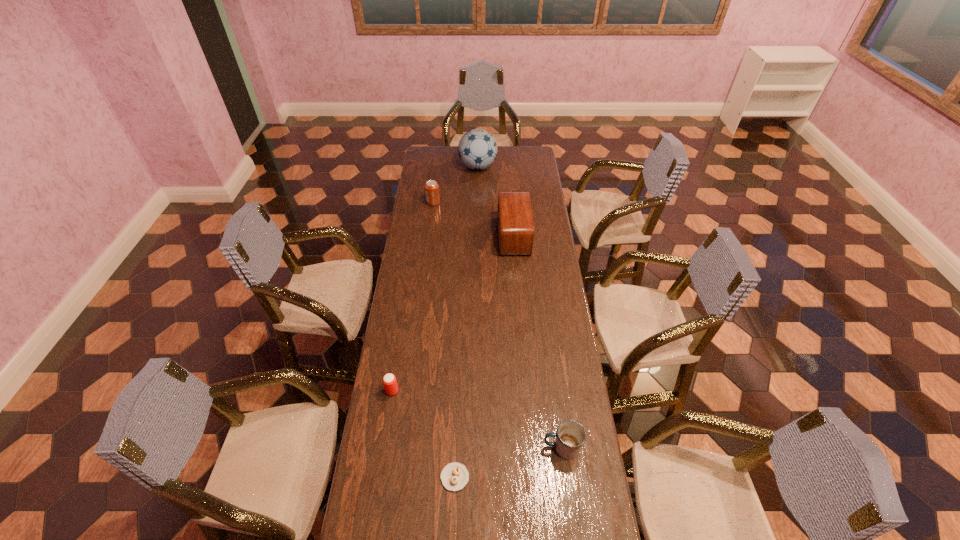
What are the coordinates of `free space located on the front of the beer can` in the screenshot? It's located at (376, 492).

This screenshot has width=960, height=540. I want to click on blank space located on the left of the cupcake, so click(403, 477).

What are the coordinates of `object that is at the far edge` in the screenshot? It's located at (477, 149).

The image size is (960, 540). I want to click on can at the left edge, so click(432, 193).

Find the location of a particular element. This screenshot has height=540, width=960. beer can that is at the left edge is located at coordinates (389, 380).

The width and height of the screenshot is (960, 540). Identify the location of radio receiver that is positioned at the right edge. (515, 220).

The width and height of the screenshot is (960, 540). Identify the location of mug present at the right edge. (571, 435).

At what (x,y) coordinates should I click in order to perform the action: click on free location at the far edge of the desktop. Please return your answer as a coordinate pair (x, y). Image resolution: width=960 pixels, height=540 pixels. Looking at the image, I should click on (500, 152).

Where is `free region at the left edge`? The height and width of the screenshot is (540, 960). free region at the left edge is located at coordinates (436, 249).

Find the location of `free space at the right edge of the desktop`. free space at the right edge of the desktop is located at coordinates (549, 393).